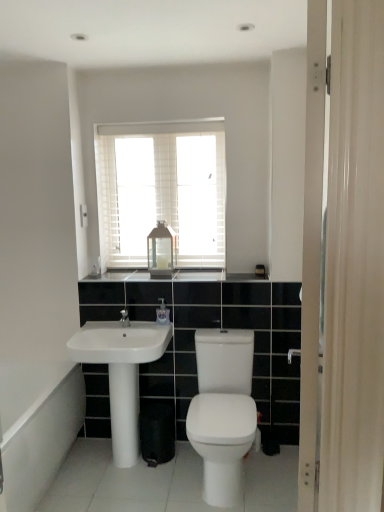
At what (x,y) coordinates should I click in order to perform the action: click on free region on the left part of matte glass lantern at center. Please return your answer as a coordinate pair (x, y). This screenshot has width=384, height=512. Looking at the image, I should click on (130, 271).